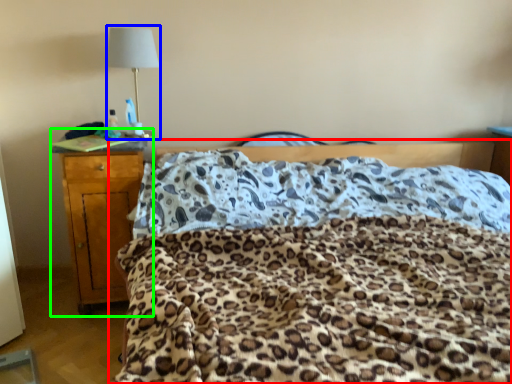
Question: Considering the real-world distances, which object is closest to bed (highlighted by a red box)? lamp (highlighted by a blue box) or nightstand (highlighted by a green box).

Choices:
 (A) lamp
 (B) nightstand

Answer: (B)